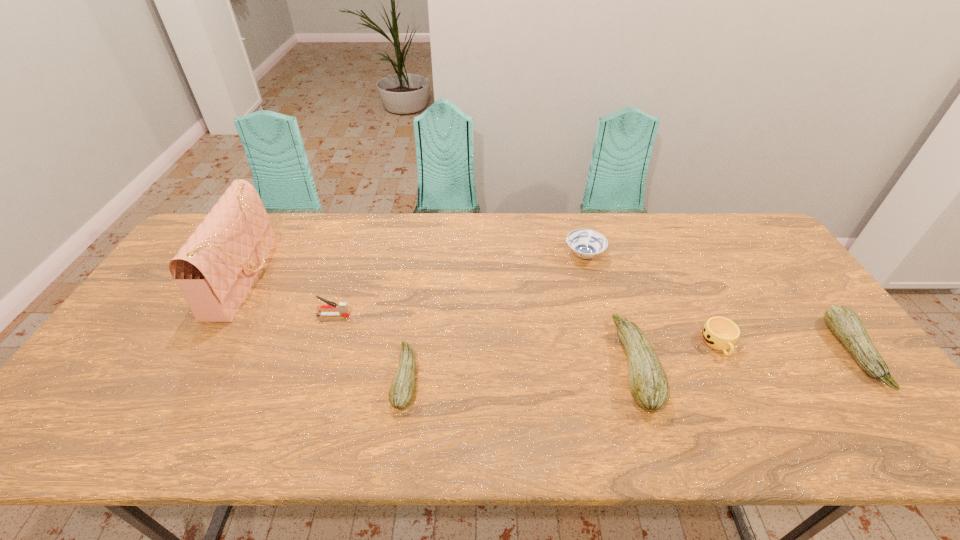
You are a GUI agent. You are given a task and a screenshot of the screen. Output one action in this format:
    pyautogui.click(x=<x>, y=<y>)
    Task: Click on the shortest zucchini
    This screenshot has height=540, width=960.
    Given the screenshot: What is the action you would take?
    pyautogui.click(x=401, y=392)

Find the location of a particular element. The width and height of the screenshot is (960, 540). the fifth object from right to left is located at coordinates [x=401, y=392].

This screenshot has height=540, width=960. Identify the location of the tallest zucchini. (649, 386).

Where is `the rightmost zucchini`? This screenshot has width=960, height=540. the rightmost zucchini is located at coordinates (844, 323).

Where is `the second shortest zucchini`? This screenshot has width=960, height=540. the second shortest zucchini is located at coordinates (844, 323).

This screenshot has height=540, width=960. What are the coordinates of `soup bowl` in the screenshot? It's located at (585, 243).

Where is `handbag`? This screenshot has width=960, height=540. handbag is located at coordinates pyautogui.click(x=216, y=267).

Identify the location of the leftmost object. Image resolution: width=960 pixels, height=540 pixels. (216, 267).

This screenshot has width=960, height=540. I want to click on cup, so click(720, 333).

Where is `the sixth object from right to left`? the sixth object from right to left is located at coordinates (343, 309).